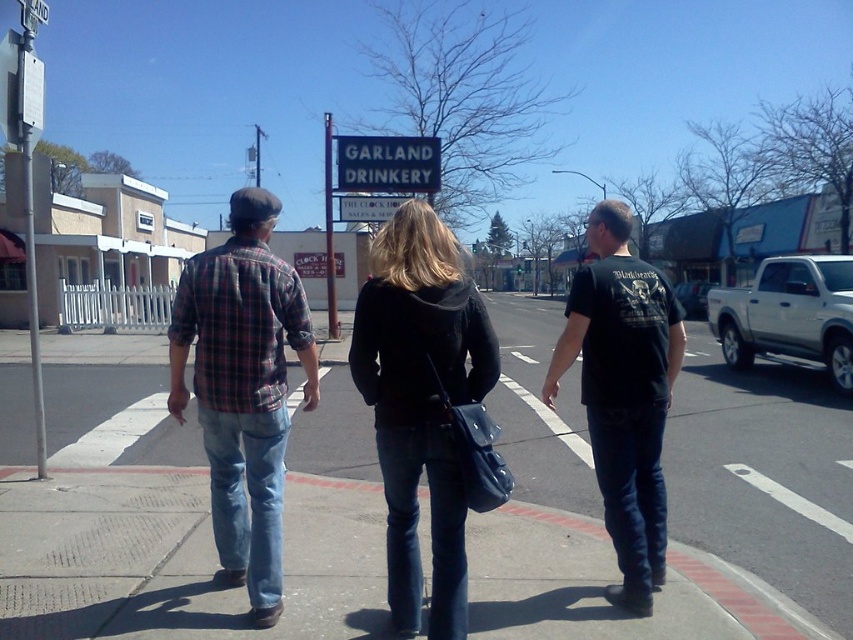
Question: Which point is closer to the camera?

Choices:
 (A) plaid shirt at center
 (B) black matte t-shirt at center
 (C) smooth concrete sidewalk at center

Answer: (C)

Question: Which point is closer to the camera taking this photo?

Choices:
 (A) (390, 476)
 (B) (683, 285)
 (C) (512, 582)

Answer: (A)

Question: Among these objects, which one is farthest from the camera?

Choices:
 (A) smooth concrete sidewalk at center
 (B) plaid shirt at center
 (C) white matte truck at right
 (D) plaid flannel shirt at center

Answer: (C)

Question: Can you confirm if plaid shirt at center is thinner than white matte truck at right?

Choices:
 (A) yes
 (B) no

Answer: (A)

Question: Does black leather jacket at center have a smaller size compared to black matte t-shirt at center?

Choices:
 (A) yes
 (B) no

Answer: (A)

Question: From the image, what is the correct spatial relationship of black matte t-shirt at center in relation to white matte truck at right?

Choices:
 (A) left
 (B) right

Answer: (A)